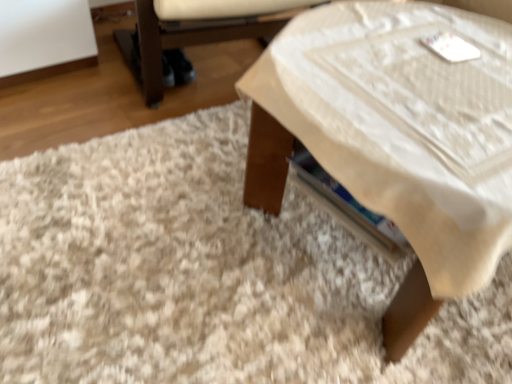
Question: Considering the relative positions of wooden table at center and white fabric armchair at lower right in the image provided, is wooden table at center to the right of white fabric armchair at lower right from the viewer's perspective?

Choices:
 (A) yes
 (B) no

Answer: (A)

Question: Can you confirm if wooden table at center is taller than white fabric armchair at lower right?

Choices:
 (A) yes
 (B) no

Answer: (A)

Question: From the image's perspective, is wooden table at center over white fabric armchair at lower right?

Choices:
 (A) no
 (B) yes

Answer: (A)

Question: Is white fabric armchair at lower right completely or partially inside wooden table at center?

Choices:
 (A) yes
 (B) no

Answer: (B)

Question: Is wooden table at center far from white fabric armchair at lower right?

Choices:
 (A) no
 (B) yes

Answer: (A)

Question: From a real-world perspective, is wooden table at center located beneath white fabric armchair at lower right?

Choices:
 (A) yes
 (B) no

Answer: (B)

Question: Does wooden table at center have a greater height compared to white shaggy rug at lower left?

Choices:
 (A) yes
 (B) no

Answer: (A)

Question: Is wooden table at center in contact with white shaggy rug at lower left?

Choices:
 (A) yes
 (B) no

Answer: (B)

Question: Considering the relative sizes of wooden table at center and white shaggy rug at lower left in the image provided, is wooden table at center bigger than white shaggy rug at lower left?

Choices:
 (A) no
 (B) yes

Answer: (B)

Question: From a real-world perspective, is wooden table at center over white shaggy rug at lower left?

Choices:
 (A) yes
 (B) no

Answer: (A)

Question: Is wooden table at center wider than white shaggy rug at lower left?

Choices:
 (A) yes
 (B) no

Answer: (B)

Question: Can you confirm if wooden table at center is smaller than white shaggy rug at lower left?

Choices:
 (A) no
 (B) yes

Answer: (A)

Question: Does white shaggy rug at lower left come behind white fabric armchair at lower right?

Choices:
 (A) yes
 (B) no

Answer: (B)